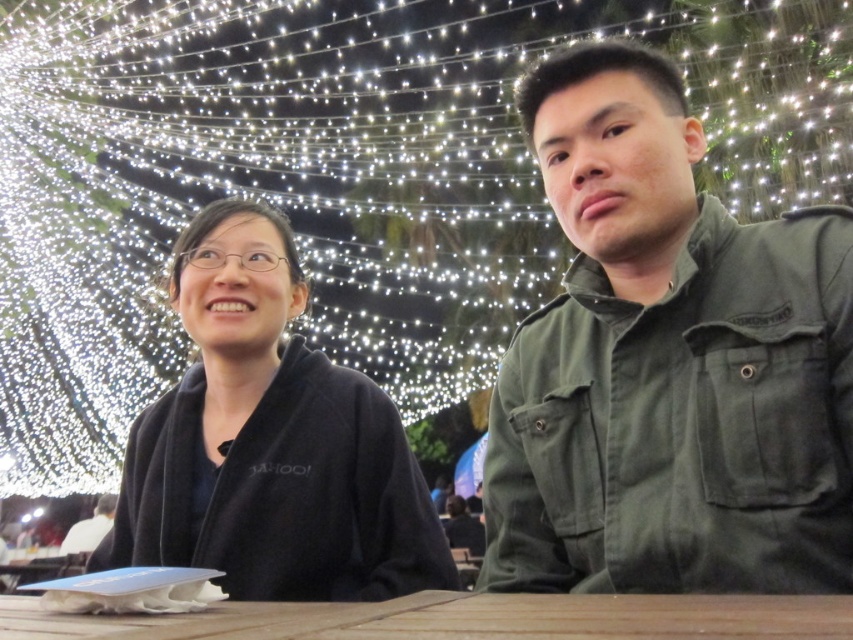
Question: Which object is positioned closest to the green matte jacket at right?

Choices:
 (A) brown wooden table at center
 (B) dark green jacket at center
 (C) black fleece jacket at left

Answer: (A)

Question: Which of these objects is positioned closest to the dark green jacket at center?

Choices:
 (A) brown wooden table at center
 (B) green matte jacket at right

Answer: (B)

Question: Considering the relative positions of green matte jacket at right and dark green jacket at center in the image provided, where is green matte jacket at right located with respect to dark green jacket at center?

Choices:
 (A) left
 (B) right

Answer: (B)

Question: Can you confirm if black fleece jacket at left is positioned below brown wooden table at center?

Choices:
 (A) no
 (B) yes

Answer: (A)

Question: Does green matte jacket at right appear on the left side of black fleece jacket at left?

Choices:
 (A) yes
 (B) no

Answer: (B)

Question: Among these objects, which one is farthest from the camera?

Choices:
 (A) black fleece jacket at left
 (B) green matte jacket at right

Answer: (A)